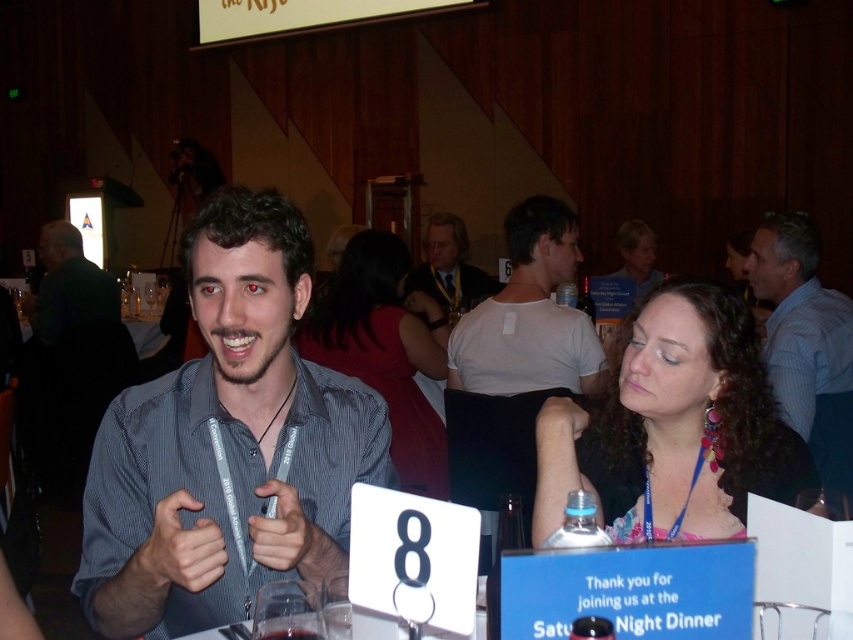
Which is more to the left, matte black dress at center or clear glass wine at upper center?

Positioned to the left is matte black dress at center.

Is matte black dress at center taller than clear glass wine at upper center?

Yes.

Between point (352, 257) and point (589, 314), which one is positioned behind?

Point (589, 314)

The height and width of the screenshot is (640, 853). Identify the location of matte black dress at center. (381, 352).

Which of these two, matte gray shirt at center or translucent glass wine at table center, stands shorter?

translucent glass wine at table center is shorter.

Between point (113, 298) and point (299, 628), which one is positioned in front?

Positioned in front is point (299, 628).

Does point (74, 337) come closer to viewer compared to point (305, 628)?

No, it is not.

Identify the location of matte gray shirt at center. (70, 360).

Who is positioned more to the right, white matte shirt at center or matte black hair at upper center?

Positioned to the right is matte black hair at upper center.

Is white matte shirt at center above matte black hair at upper center?

Actually, white matte shirt at center is below matte black hair at upper center.

Is point (488, 356) positioned behind point (635, 292)?

No.

The width and height of the screenshot is (853, 640). I want to click on white matte shirt at center, so click(x=529, y=314).